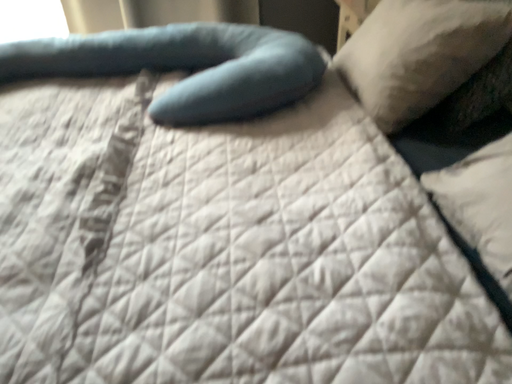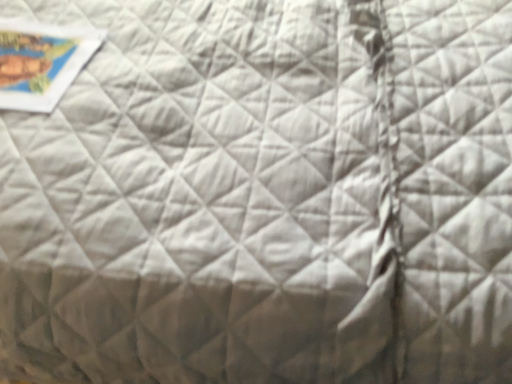
Question: Which way did the camera rotate in the video?

Choices:
 (A) rotated downward
 (B) rotated upward

Answer: (A)